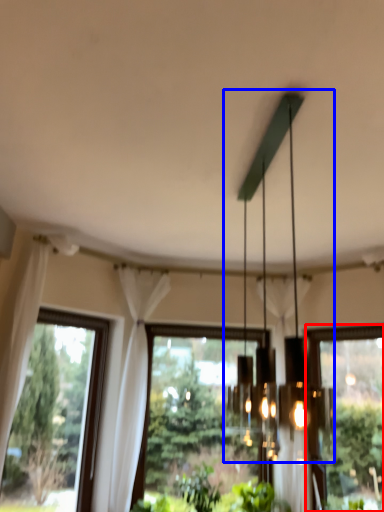
Question: Which object is further to the camera taking this photo, window (highlighted by a red box) or chandelier (highlighted by a blue box)?

Choices:
 (A) window
 (B) chandelier

Answer: (A)